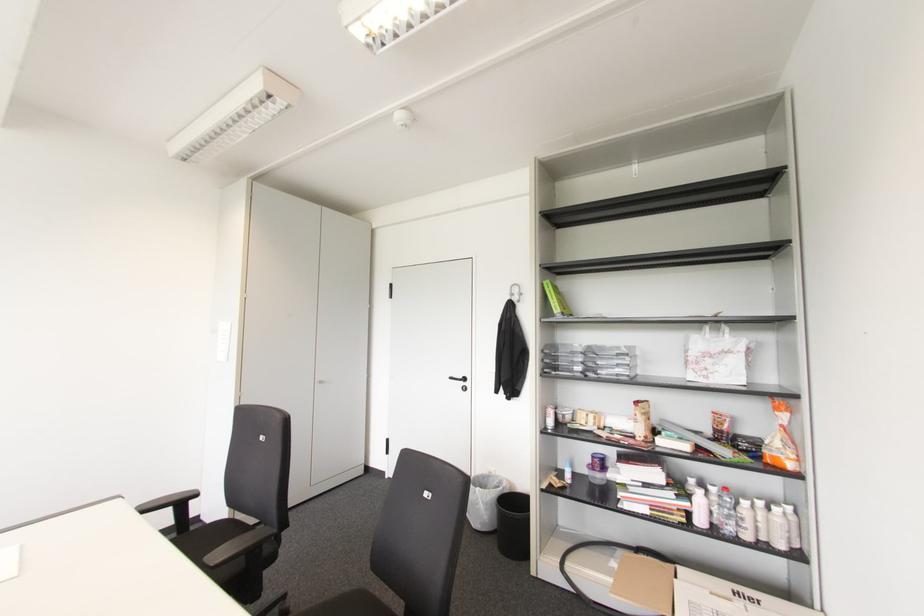
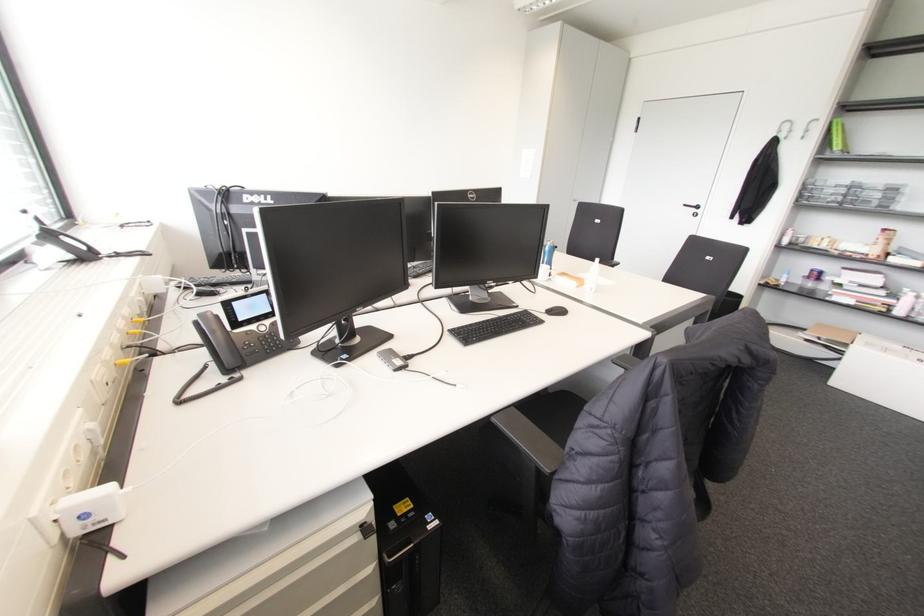
Where in the second image is the point corresponding to (x=555, y=309) from the first image?

(836, 147)